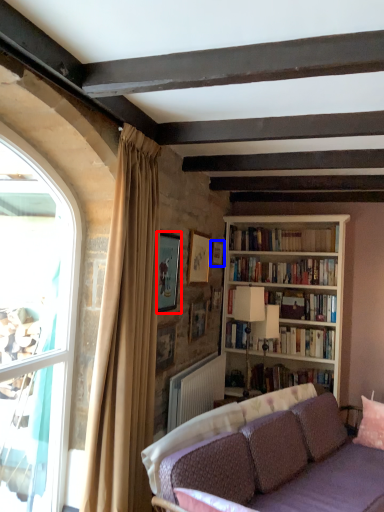
Question: Which point is further to the camera, picture frame (highlighted by a red box) or picture frame (highlighted by a blue box)?

Choices:
 (A) picture frame
 (B) picture frame

Answer: (B)